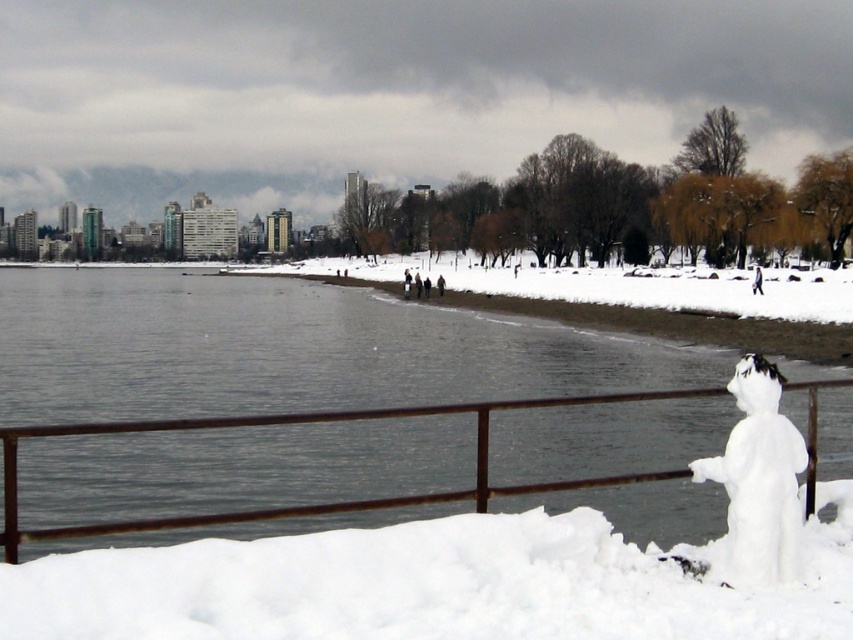
Can you confirm if rusty metal fence at lower center is bigger than white fluffy snowman at lower right?

Yes.

Is point (509, 486) more distant than point (764, 458)?

No, it is in front of (764, 458).

Locate an element on the screen. rusty metal fence at lower center is located at coordinates (321, 502).